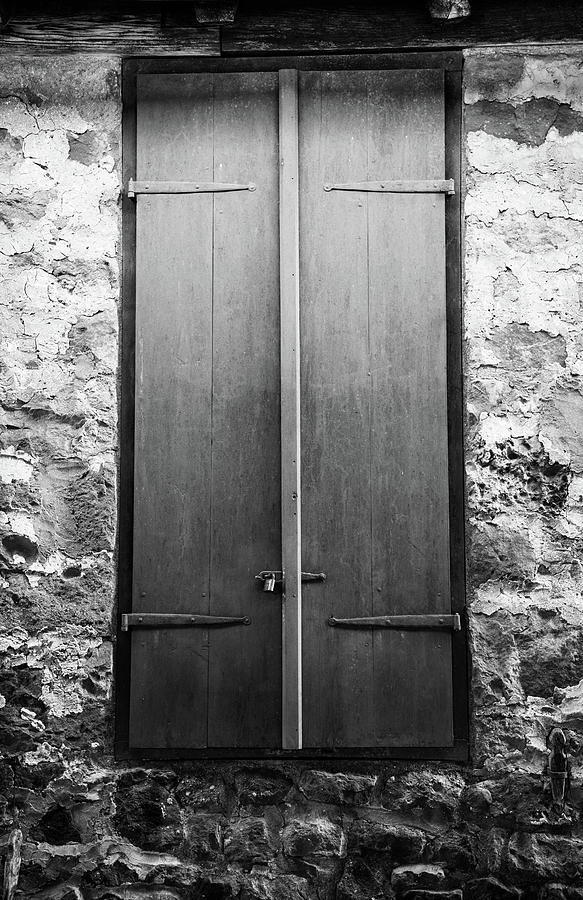
I want to click on center piece of door, so click(287, 223).